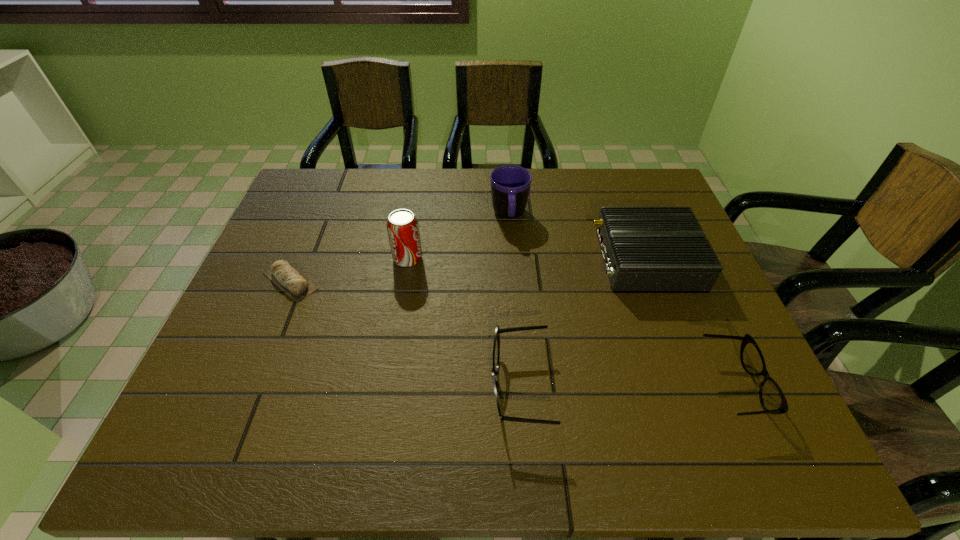
At what (x,y) coordinates should I click in order to perform the action: click on the left spectacles. Please return your answer as a coordinate pair (x, y). Image resolution: width=960 pixels, height=540 pixels. Looking at the image, I should click on (496, 346).

The height and width of the screenshot is (540, 960). Find the location of `the third shortest object`. the third shortest object is located at coordinates (496, 346).

Image resolution: width=960 pixels, height=540 pixels. Find the location of `the shorter spectacles`. the shorter spectacles is located at coordinates (772, 399).

You are a GUI agent. You are given a task and a screenshot of the screen. Output one action in this format:
    pyautogui.click(x=<x>, y=<y>)
    Task: Click on the right spectacles
    This screenshot has width=960, height=540.
    Given the screenshot: What is the action you would take?
    pyautogui.click(x=772, y=399)

Where is `the fifth shortest object`? This screenshot has height=540, width=960. the fifth shortest object is located at coordinates (510, 185).

Locate an element on the screen. router is located at coordinates (645, 249).

Identify the location of the leftmost object. This screenshot has width=960, height=540. (285, 276).

Locate an element on the screen. Image resolution: width=960 pixels, height=540 pixels. pita bread is located at coordinates point(285,276).

You are a GUI agent. You are given a task and a screenshot of the screen. Output one action in this format:
    pyautogui.click(x=<x>, y=<y>)
    Task: Click on the soda can
    
    Given the screenshot: What is the action you would take?
    pyautogui.click(x=402, y=226)

Find the location of a particular element. The image size is (960, 540). vacant space located on the front-facing side of the fourth tallest object is located at coordinates (396, 387).